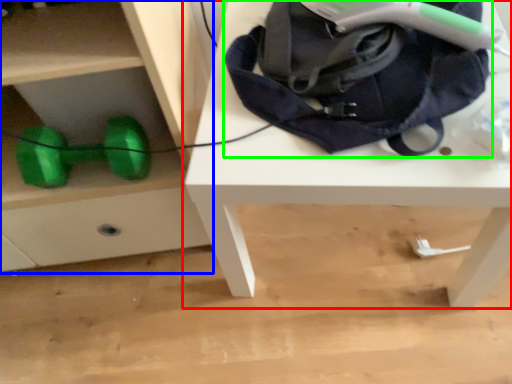
Question: Which object is the closest to the table (highlighted by a red box)? Choose among these: chest of drawers (highlighted by a blue box) or bag (highlighted by a green box).

Choices:
 (A) chest of drawers
 (B) bag

Answer: (B)